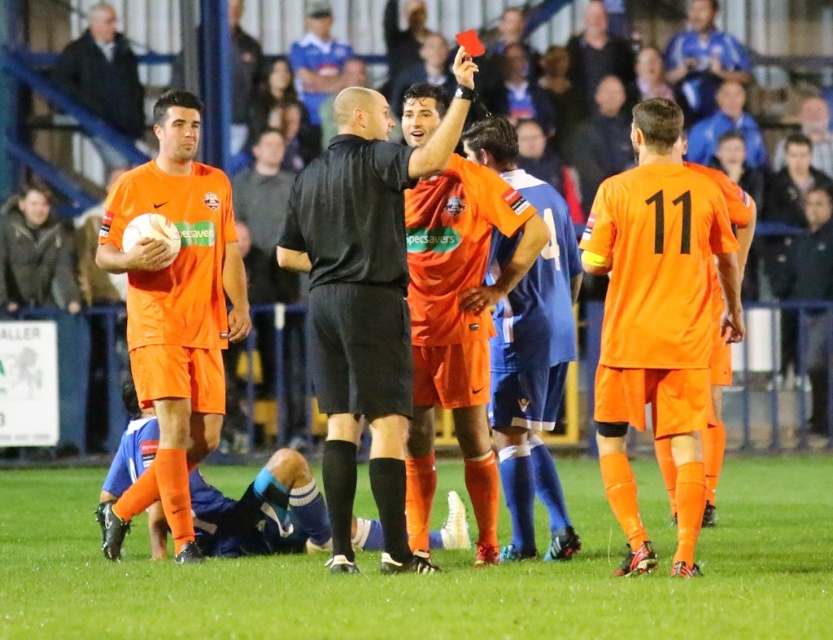
Is orange synthetic turf at center positioned at the back of orange matte uniform at center?

No.

Can you confirm if orange synthetic turf at center is positioned to the left of orange matte uniform at center?

No, orange synthetic turf at center is not to the left of orange matte uniform at center.

What do you see at coordinates (437, 572) in the screenshot? This screenshot has height=640, width=833. I see `orange synthetic turf at center` at bounding box center [437, 572].

You are a GUI agent. You are given a task and a screenshot of the screen. Output one action in this format:
    pyautogui.click(x=<x>, y=<y>)
    Task: Click on the orange synthetic turf at center
    The height and width of the screenshot is (640, 833).
    Given the screenshot: What is the action you would take?
    pyautogui.click(x=437, y=572)

How much distance is there between orange matte/synthetic soccer player at center and matte orange soccer uniform at left?

orange matte/synthetic soccer player at center is 3.15 meters away from matte orange soccer uniform at left.

Who is more distant from viewer, (664, 240) or (128, 211)?

Positioned behind is point (128, 211).

Locate an element on the screen. orange matte/synthetic soccer player at center is located at coordinates (657, 321).

Is orange synthetic turf at center above dark gray jacket at upper left?

No, orange synthetic turf at center is not above dark gray jacket at upper left.

Can you confirm if orange synthetic turf at center is positioned below dark gray jacket at upper left?

Yes, orange synthetic turf at center is below dark gray jacket at upper left.

Does point (797, 515) lie behind point (130, 60)?

That is False.

The height and width of the screenshot is (640, 833). I want to click on orange synthetic turf at center, so click(x=437, y=572).